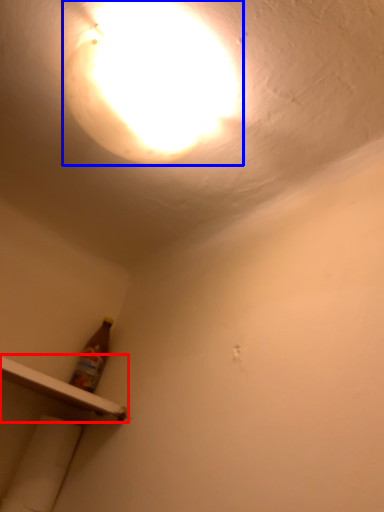
Question: Which of the following is the closest to the observer, shelf (highlighted by a red box) or lamp (highlighted by a blue box)?

Choices:
 (A) shelf
 (B) lamp

Answer: (B)